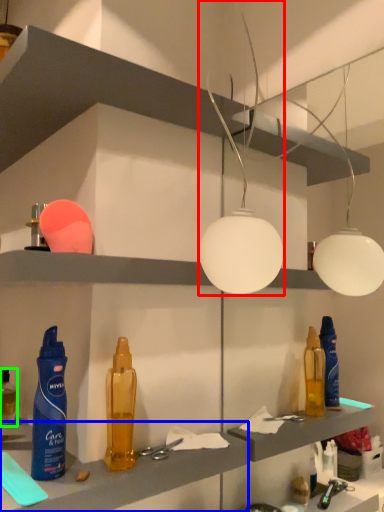
Question: Which is farther away from lamp (highlighted by a red box)? cabinet (highlighted by a blue box) or bottle (highlighted by a green box)?

Choices:
 (A) cabinet
 (B) bottle

Answer: (B)